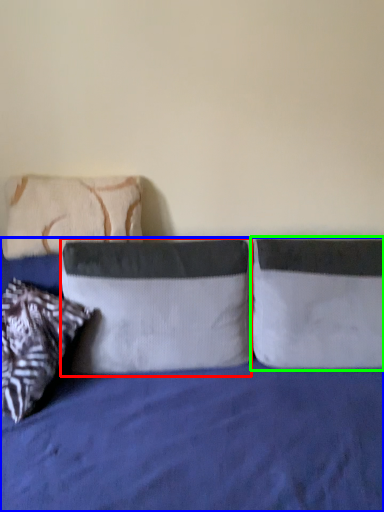
Question: Which is farther away from pillow (highlighted by a red box)? bed (highlighted by a blue box) or pillow (highlighted by a green box)?

Choices:
 (A) bed
 (B) pillow

Answer: (B)